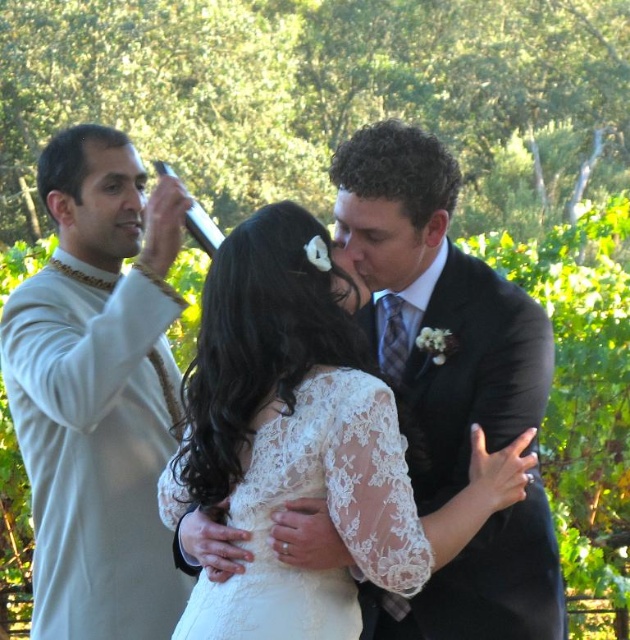
You are a photographer capturing the wedding ceremony. You notice the white lace dress at center and the shiny black suit at center. Which one is closer to the camera?

The white lace dress at center is closer to the camera because it is in front of the shiny black suit at center.